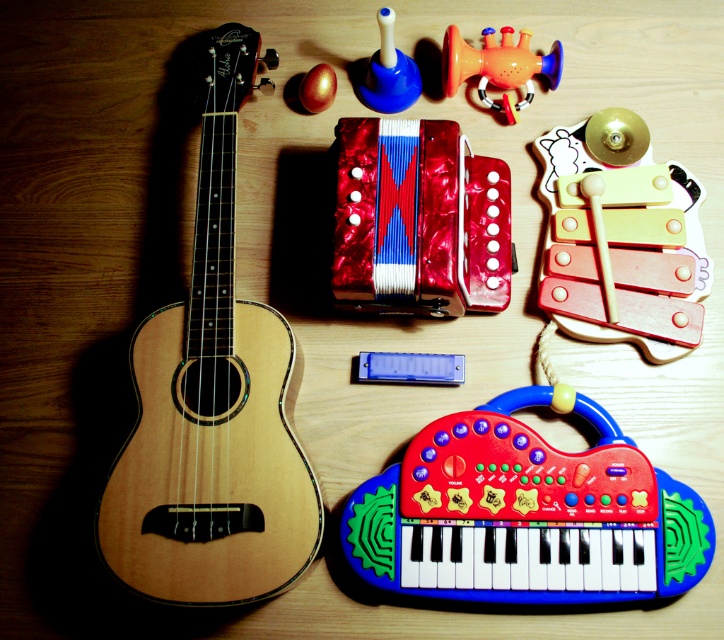
Is wooden xylophone at upper right shorter than shiny red pearlized accordion at upper center?

In fact, wooden xylophone at upper right may be taller than shiny red pearlized accordion at upper center.

Is point (563, 310) closer to camera compared to point (392, 182)?

No, (563, 310) is further to viewer.

The width and height of the screenshot is (724, 640). What do you see at coordinates (620, 237) in the screenshot?
I see `wooden xylophone at upper right` at bounding box center [620, 237].

Locate an element on the screen. wooden xylophone at upper right is located at coordinates (620, 237).

Does rubberized plastic keyboard at bottom center have a lesser height compared to wooden xylophone at upper right?

Yes.

Does rubberized plastic keyboard at bottom center have a smaller size compared to wooden xylophone at upper right?

No, rubberized plastic keyboard at bottom center is not smaller than wooden xylophone at upper right.

Find the location of a particular element. The image size is (724, 640). rubberized plastic keyboard at bottom center is located at coordinates (526, 515).

Is natural wood guitar at left taller than wooden xylophone at upper right?

Correct, natural wood guitar at left is much taller as wooden xylophone at upper right.

Between natural wood guitar at left and wooden xylophone at upper right, which one has more height?

With more height is natural wood guitar at left.

Is point (146, 380) farther from camera compared to point (631, 157)?

No, it is in front of (631, 157).

The width and height of the screenshot is (724, 640). I want to click on natural wood guitar at left, so click(x=211, y=403).